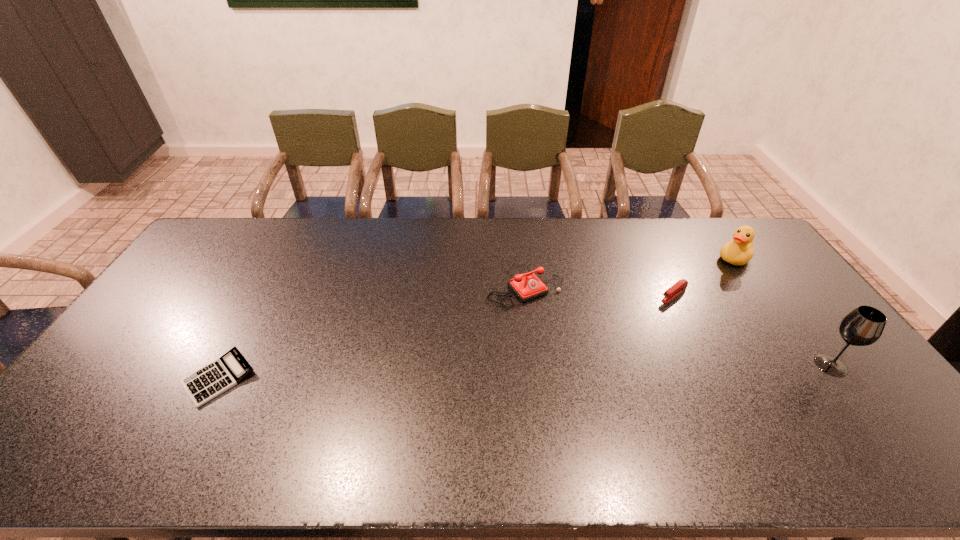
Where is `object that is positioned at the near edge`? The height and width of the screenshot is (540, 960). object that is positioned at the near edge is located at coordinates (203, 385).

Identify the location of wineglass that is positioned at the right edge. (863, 326).

At what (x,y) coordinates should I click in order to perform the action: click on duck situated at the right edge. Please return your answer as a coordinate pair (x, y). Looking at the image, I should click on (739, 251).

At what (x,y) coordinates should I click in order to perform the action: click on object positioned at the far right corner. Please return your answer as a coordinate pair (x, y). Looking at the image, I should click on (739, 251).

Where is `vacant point at the far edge`? The image size is (960, 540). vacant point at the far edge is located at coordinates (325, 222).

Identify the location of free region at the near edge. (727, 419).

This screenshot has height=540, width=960. I want to click on free space at the left edge of the desktop, so click(x=125, y=373).

Locate an element on the screen. This screenshot has height=540, width=960. free region at the right edge is located at coordinates (784, 310).

Find the location of a particular element. The height and width of the screenshot is (540, 960). free region at the far left corner of the desktop is located at coordinates (199, 251).

Find the location of a particular element. This screenshot has height=540, width=960. vacant area at the far right corner is located at coordinates [756, 253].